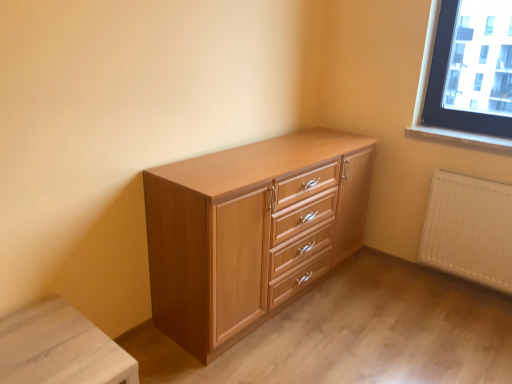
At what (x,y) coordinates should I click in order to perform the action: click on vacant space that is to the left of white matte radiator at lower right. Please return your answer as a coordinate pair (x, y). The image size is (512, 384). Looking at the image, I should click on (409, 286).